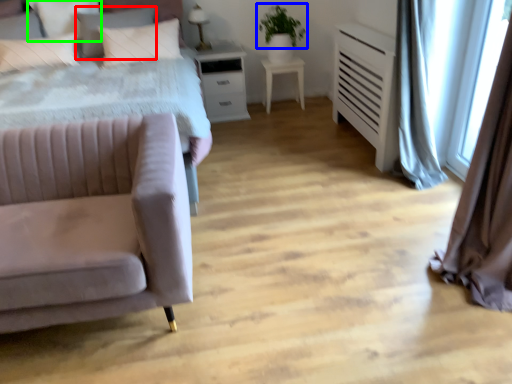
Question: Estimate the real-world distances between objects in this image. Which object is farther from pillow (highlighted by a red box), plant (highlighted by a blue box) or pillow (highlighted by a green box)?

Choices:
 (A) plant
 (B) pillow

Answer: (A)